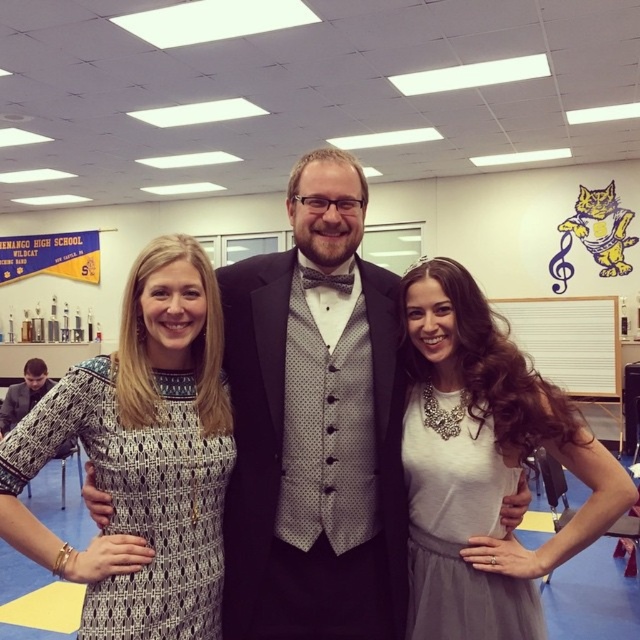
You are standing in the gymnasium and want to take a photo of the point at coordinates point (296, 321). If your camera has a maximum focus range of 5 feet, will it be able to focus on that point?

The distance of point (296, 321) from the camera is 5.18 feet, which exceeds the camera maximum focus range of 5 feet. Therefore, the camera cannot focus on that point.

You are standing at the point labeled point (451,506) and want to take a photo of the three people in the gymnasium. The camera you have can only focus on subjects within 1.5 meters. Will the camera be able to focus on the three people?

The distance between point (451,506) and the camera is 1.52 meters, which is slightly beyond the camera focus range of 1.5 meters. Therefore, the camera may not be able to focus on the three people.

You are a photographer setting up for a group photo. You need to ensure that the black satin tuxedo at center and the printed fabric dress at center are positioned so that they are at least 10 inches apart to avoid overlapping in the photo. Based on the current setup, is this requirement met?

The black satin tuxedo at center is 9.76 inches from the printed fabric dress at center. Since 9.76 inches is less than the required 10 inches, the requirement is not met. They are too close and may overlap in the photo.